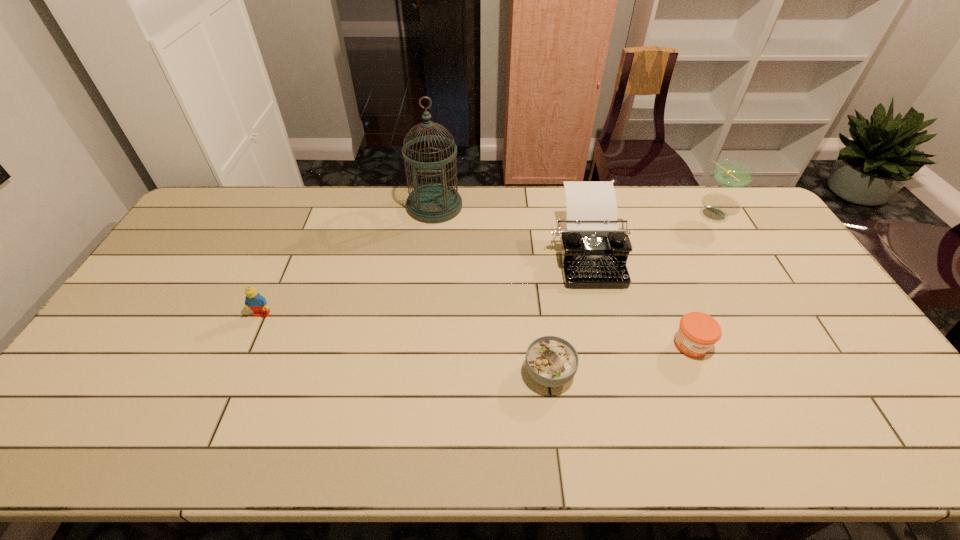
This screenshot has width=960, height=540. I want to click on free space that is in between the typewriter and the fifth object from right to left, so click(510, 229).

Find the location of a particular element. This screenshot has height=540, width=960. vacant space in between the martini and the soup bowl is located at coordinates (632, 294).

Where is `free space between the tallest object and the third shortest object`? free space between the tallest object and the third shortest object is located at coordinates (348, 260).

Find the location of a particular element. object that can be found as the second closest to the tallest object is located at coordinates (257, 303).

Where is `object that is the fifth nearest to the soup bowl`? object that is the fifth nearest to the soup bowl is located at coordinates (732, 173).

I want to click on free space that satisfies the following two spatial constraints: 1. on the front-facing side of the rightmost object; 2. on the left side of the birdcage, so click(x=434, y=215).

Where is `free location that satisfies the following two spatial constraints: 1. on the front-facing side of the soup bowl; 2. on the right side of the birdcage`? free location that satisfies the following two spatial constraints: 1. on the front-facing side of the soup bowl; 2. on the right side of the birdcage is located at coordinates (415, 373).

Find the location of `vacant area that satisfies the following two spatial constraints: 1. on the face of the leftmost object; 2. on the right side of the soup bowl`. vacant area that satisfies the following two spatial constraints: 1. on the face of the leftmost object; 2. on the right side of the soup bowl is located at coordinates (236, 373).

Image resolution: width=960 pixels, height=540 pixels. I want to click on free space that satisfies the following two spatial constraints: 1. on the face of the third nearest object; 2. on the right side of the soup bowl, so click(x=236, y=373).